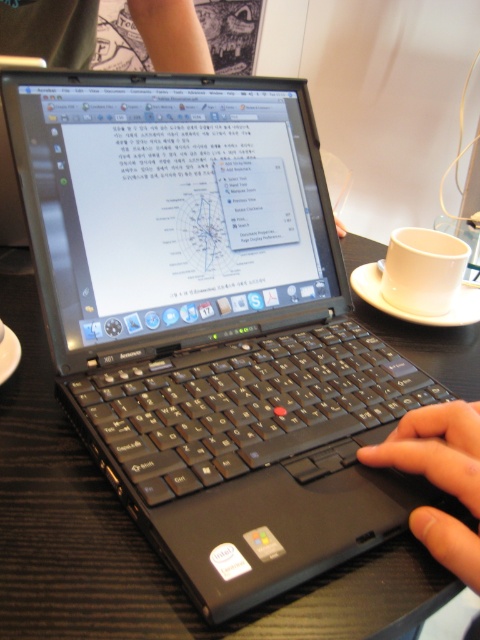
Looking at this image, you are a delivery person who needs to place a small package on the table without disturbing the laptop or the hand. The package is 25 centimeters long. Is there enough space between the black matte hand at lower right and the white ceramic cup at right to place the package horizontally?

The black matte hand at lower right and white ceramic cup at right are 26.09 centimeters apart from each other. Since the package is 25 centimeters long, it can fit between them horizontally without disturbing either object.

You are a barista who needs to place a new cup on the table without blocking the hand that is using the laptop. Based on the scene, can you determine if the white ceramic cup at right is tall enough to prevent the black matte hand at lower right from reaching the cup?

The black matte hand at lower right has a lesser height compared to white ceramic cup at right, so the cup is taller than the hand. This means the hand might not be able to reach the cup easily, so placing the cup there could block the hand from accessing the laptop.